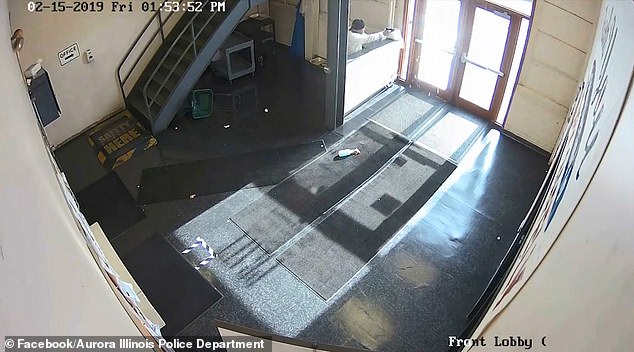
The width and height of the screenshot is (634, 352). In order to click on plastic container in this screenshot , I will do `click(200, 109)`.